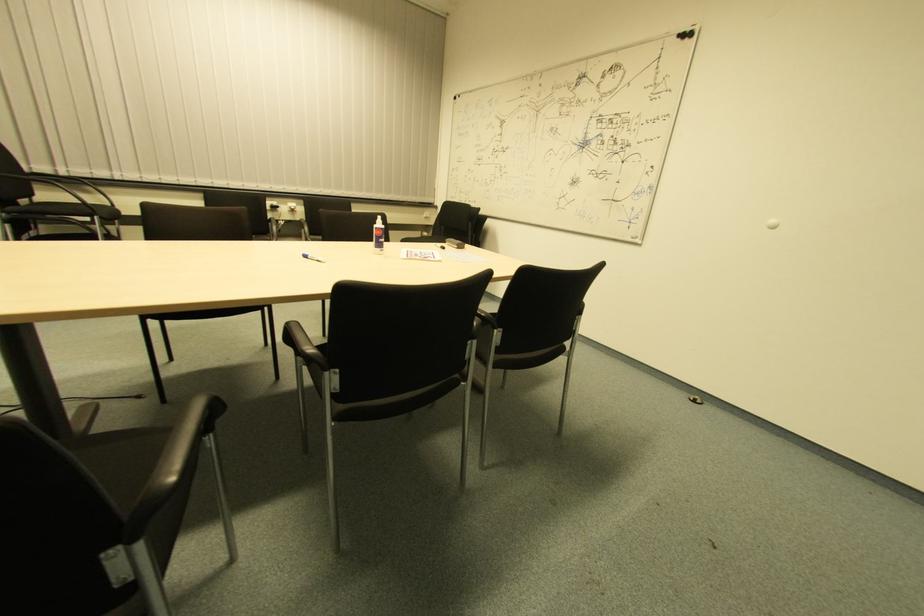
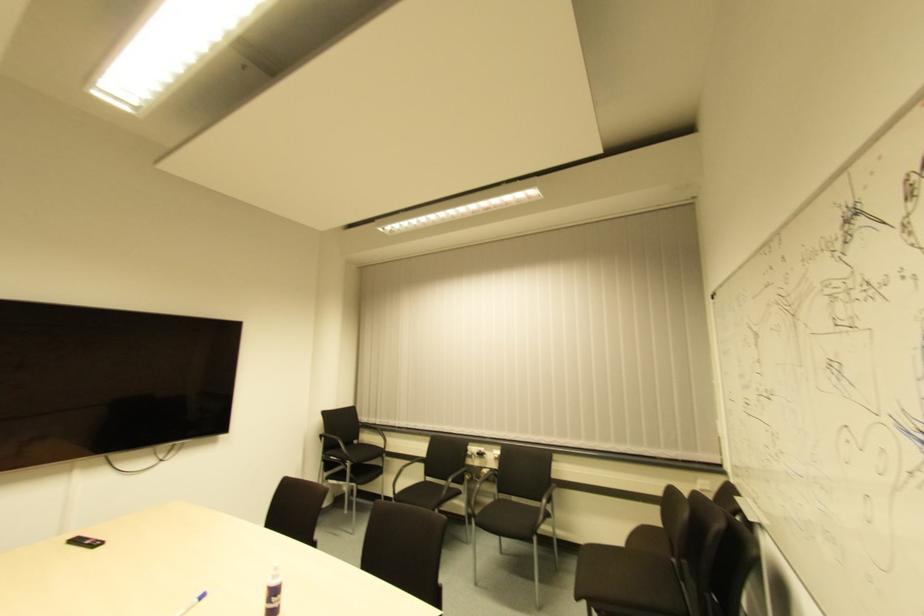
In the second image, find the point that corresponds to point (290, 214) in the first image.

(494, 462)